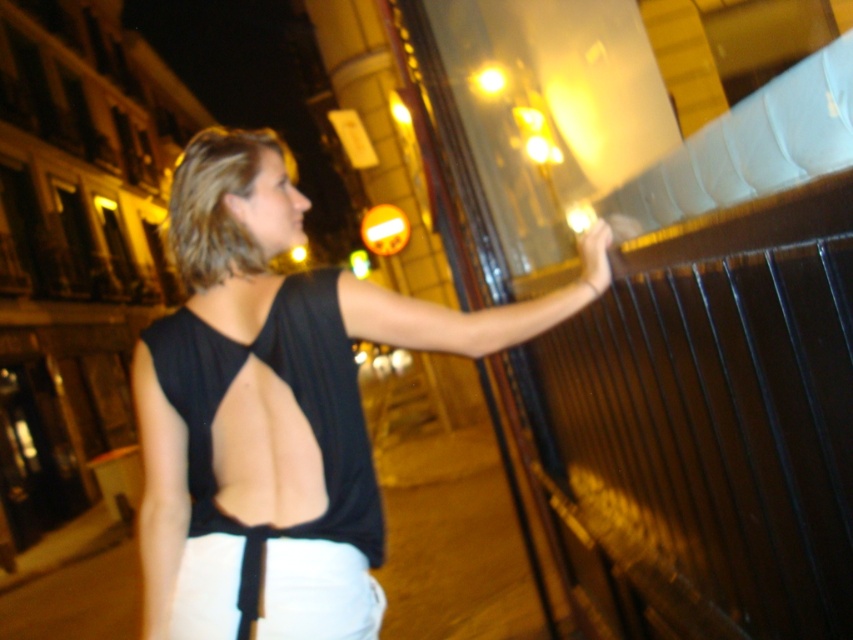
Question: Is black matte tank top at center thinner than black matte bikini top at upper center?

Choices:
 (A) yes
 (B) no

Answer: (B)

Question: Which of the following is the farthest from the observer?

Choices:
 (A) (281, 154)
 (B) (749, 268)

Answer: (A)

Question: Which object is the closest to the matte black hand at upper right?

Choices:
 (A) black matte bikini top at upper center
 (B) black matte tank top at center
 (C) dark wood fence at upper right

Answer: (C)

Question: Can you confirm if dark wood fence at upper right is thinner than black matte bikini top at upper center?

Choices:
 (A) no
 (B) yes

Answer: (B)

Question: Which of the following is the closest to the observer?

Choices:
 (A) (381, 548)
 (B) (633, 518)
 (C) (172, 499)

Answer: (C)

Question: Can you confirm if dark wood fence at upper right is positioned to the left of black matte bikini top at upper center?

Choices:
 (A) no
 (B) yes

Answer: (A)